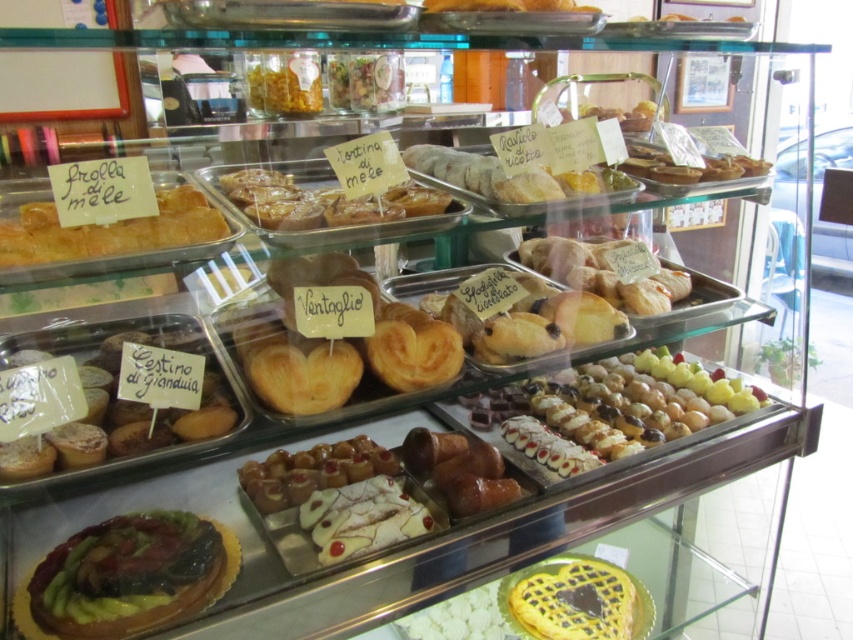
Question: Is white glossy cake at center positioned behind shiny golden pastry at center?

Choices:
 (A) no
 (B) yes

Answer: (A)

Question: Is glazed pastry at center below white glossy cake at center?

Choices:
 (A) no
 (B) yes

Answer: (A)

Question: Which object is closer to the camera taking this photo?

Choices:
 (A) glazed pastry at center
 (B) white glossy cake at center
 (C) shiny golden pastry at center

Answer: (B)

Question: Which of the following is the closest to the observer?

Choices:
 (A) [x=364, y=552]
 (B) [x=541, y=410]

Answer: (A)

Question: Which object is the closest to the shiny golden pastry at center?

Choices:
 (A) glazed pastry at center
 (B) shiny green and red fruit tart at center
 (C) white glossy cake at center

Answer: (A)

Question: Where is glazed pastry at center located in relation to shiny golden pastry at center in the image?

Choices:
 (A) right
 (B) left

Answer: (A)